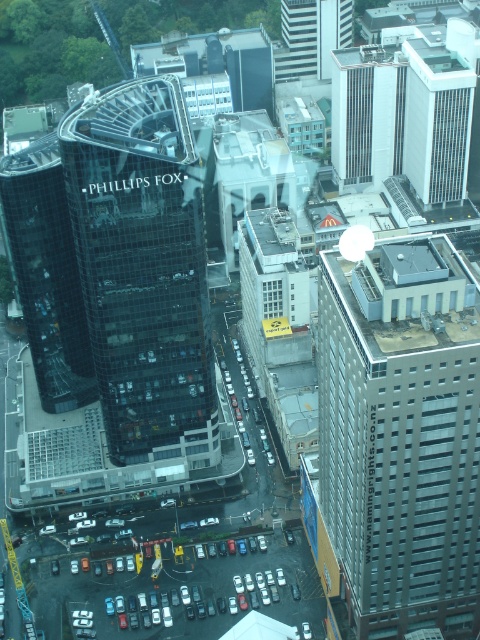
You are standing at the point with coordinates point (402, 435) in the urban area. What type of building are you in front of?

The point (402, 435) corresponds to the metallic silver building at upper right, so you are in front of a metallic silver building at upper right.

You are a drone operator tasked with flying a drone from the metallic silver building at upper right to the metallic silver tower at upper center. The drone has a maximum flight range of 250 meters. Can the drone reach the tower without needing to recharge?

The metallic silver building at upper right is 247.41 meters from the metallic silver tower at upper center. Since the distance is less than the drone s 250 meter range, the drone can reach the tower without needing to recharge.